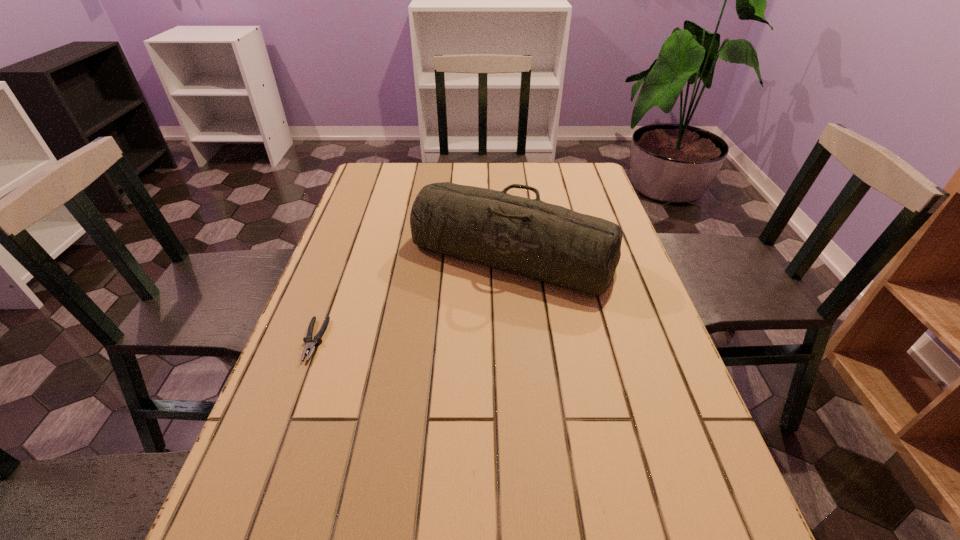
Find the location of a particular element. Image resolution: width=960 pixels, height=540 pixels. vacant position at the right edge of the desktop is located at coordinates (636, 312).

Where is `vacant position at the far left corner of the desktop`? vacant position at the far left corner of the desktop is located at coordinates (374, 192).

In the image, there is a desktop. Where is `vacant region at the far right corner`? The height and width of the screenshot is (540, 960). vacant region at the far right corner is located at coordinates (585, 168).

The width and height of the screenshot is (960, 540). I want to click on empty location between the right object and the shorter object, so [413, 297].

Find the location of a particular element. The image size is (960, 540). free point between the shorter object and the duffel bag is located at coordinates (413, 297).

You are a GUI agent. You are given a task and a screenshot of the screen. Output one action in this format:
    pyautogui.click(x=<x>, y=<y>)
    Task: Click on the free space between the pliers and the taller object
    
    Given the screenshot: What is the action you would take?
    pyautogui.click(x=413, y=297)

Where is `vacant area that lies between the taller object and the pliers`? vacant area that lies between the taller object and the pliers is located at coordinates (413, 297).

In order to click on empty space that is in between the nearer object and the taller object in this screenshot , I will do `click(413, 297)`.